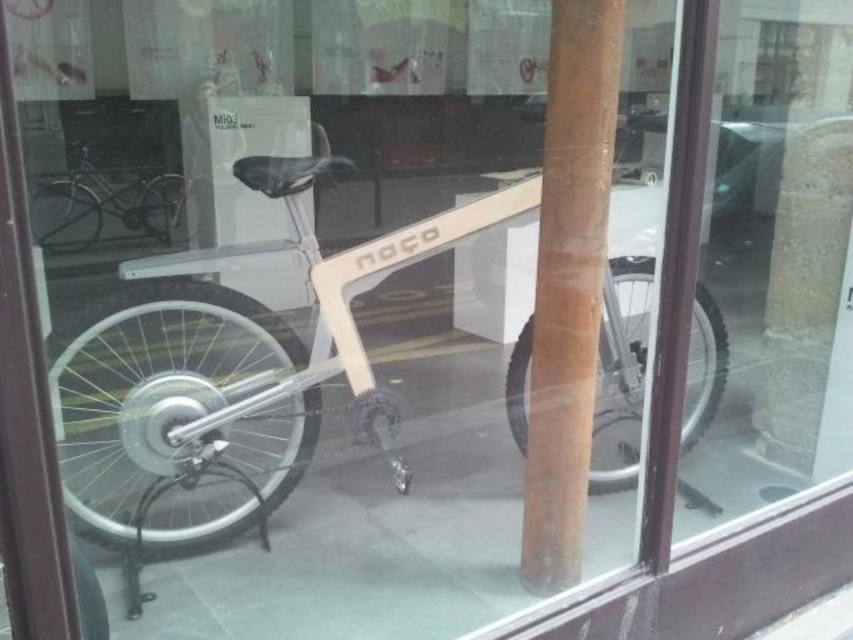
The width and height of the screenshot is (853, 640). What are the coordinates of `brown wood pole at center` in the screenshot? It's located at (567, 284).

The width and height of the screenshot is (853, 640). In order to click on brown wood pole at center in this screenshot , I will do `click(567, 284)`.